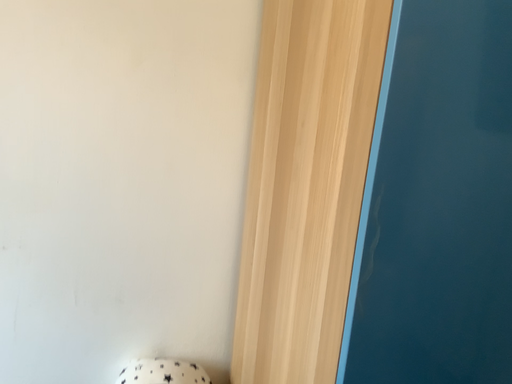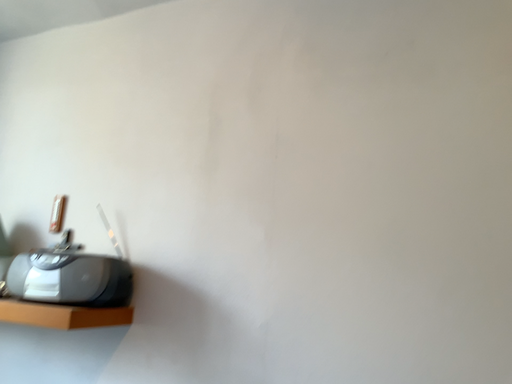
Question: How did the camera likely rotate when shooting the video?

Choices:
 (A) rotated right
 (B) rotated left

Answer: (B)